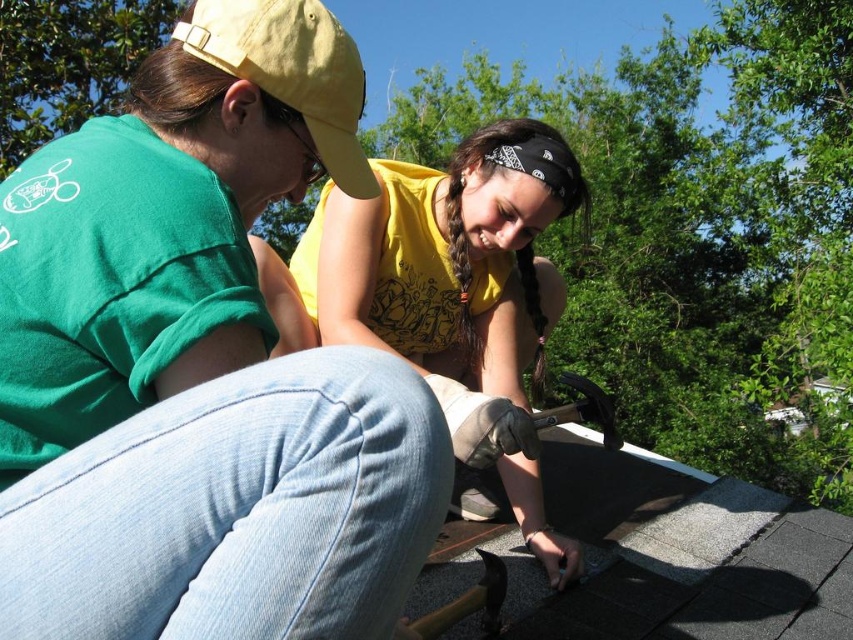
Question: Estimate the real-world distances between objects in this image. Which object is closer to the matte yellow cap at upper left?

Choices:
 (A) yellow fabric baseball cap at upper left
 (B) yellow matte shirt at center

Answer: (A)

Question: Which of the following is the farthest from the observer?

Choices:
 (A) yellow fabric baseball cap at upper left
 (B) matte yellow cap at upper left

Answer: (A)

Question: Considering the relative positions of matte yellow cap at upper left and yellow fabric baseball cap at upper left in the image provided, where is matte yellow cap at upper left located with respect to yellow fabric baseball cap at upper left?

Choices:
 (A) above
 (B) below

Answer: (B)

Question: Is matte yellow cap at upper left above yellow fabric baseball cap at upper left?

Choices:
 (A) yes
 (B) no

Answer: (B)

Question: Which of the following is the farthest from the observer?

Choices:
 (A) yellow fabric baseball cap at upper left
 (B) yellow matte shirt at center

Answer: (B)

Question: Is yellow matte shirt at center to the left of yellow fabric baseball cap at upper left from the viewer's perspective?

Choices:
 (A) yes
 (B) no

Answer: (B)